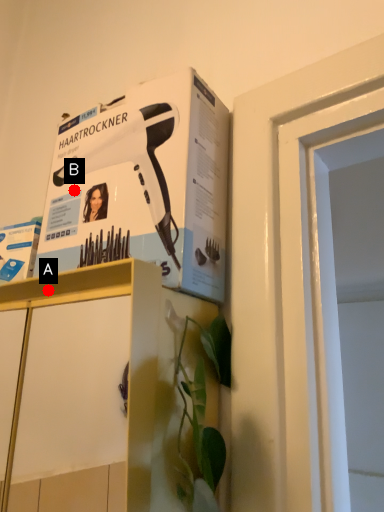
Question: Two points are circled on the image, labeled by A and B beside each circle. Which of the following is the closest to the observer?

Choices:
 (A) A is closer
 (B) B is closer

Answer: (A)